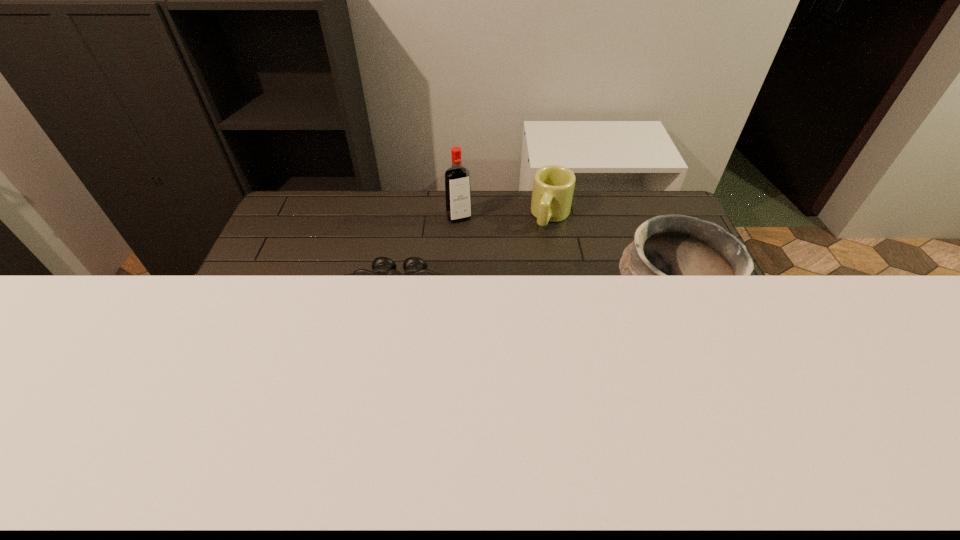
You are a GUI agent. You are given a task and a screenshot of the screen. Output one action in this format:
    pyautogui.click(x=<x>, y=<y>)
    Task: Click on the vacant space on the desktop that is between the binoculars and the third shortest object and is positioned with the handle on the side of the mug
    This screenshot has width=960, height=540.
    Given the screenshot: What is the action you would take?
    pyautogui.click(x=509, y=308)

In order to click on free spot on the desktop that is between the binoculars and the third shortest object and is positioned on the front and back of the vodka in this screenshot , I will do (x=503, y=308).